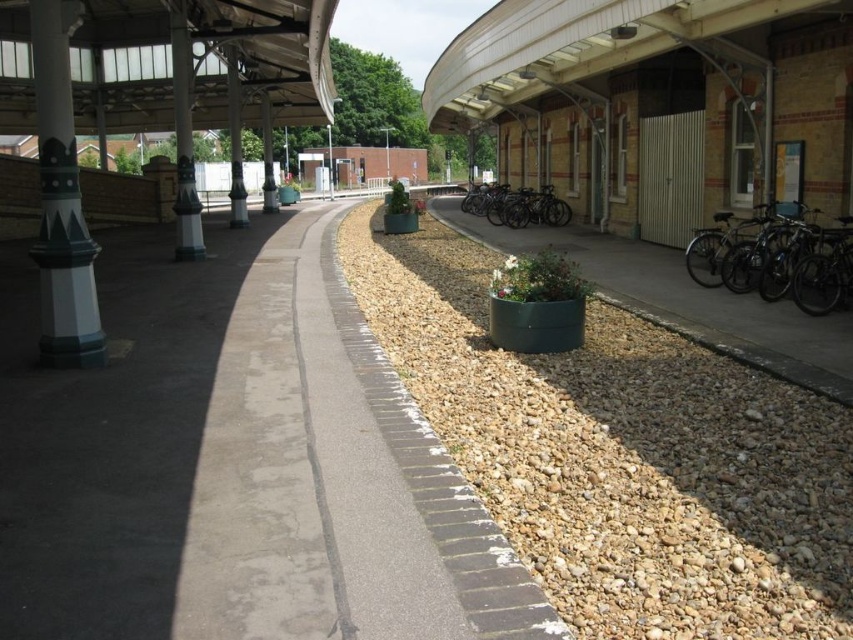
You are a maintenance worker inspecting the pillars on the platform. You notice the green painted metal column at left and the brushed metal pillar at center. Which pillar do you need to adjust the height of to make them equal?

The green painted metal column at left has a lesser height compared to the brushed metal pillar at center, so you need to adjust the green painted metal column at left to increase its height to match the brushed metal pillar at center.

Based on the photo, you are standing on the platform of the railway station and want to locate the shiny metallic bicycles at right. According to the coordinate system where the bottom left corner is the origin, where would you find them?

The shiny metallic bicycles at right are located at point (776, 257) in the coordinate system.

You are standing on the railway platform and notice two pillars, the black polished pillar at center and the brushed metal pillar at center. Which one is located to the right when facing the platform?

The black polished pillar at center is positioned on the right side of the brushed metal pillar at center, so when facing the platform, the black polished pillar at center is to the right of the brushed metal pillar at center.